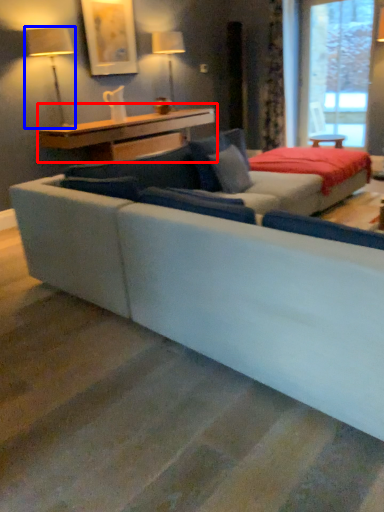
Question: Which object appears closest to the camera in this image, table (highlighted by a red box) or table lamp (highlighted by a blue box)?

Choices:
 (A) table
 (B) table lamp

Answer: (B)